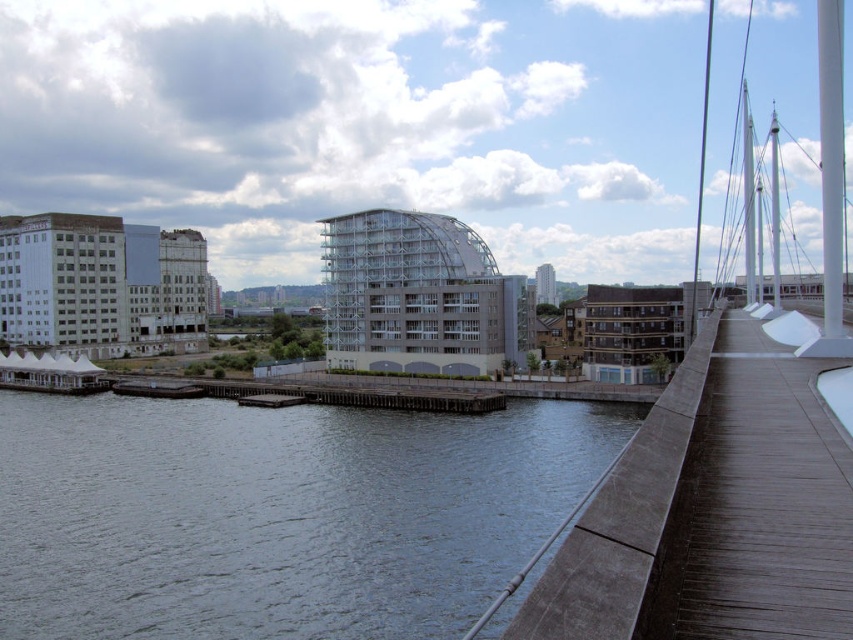
Question: Which of the following is the farthest from the observer?

Choices:
 (A) brown wooden path at right
 (B) dark gray water at lower left

Answer: (B)

Question: Which of the following is the farthest from the observer?

Choices:
 (A) dark gray water at lower left
 (B) brown wooden path at right

Answer: (A)

Question: From the image, what is the correct spatial relationship of dark gray water at lower left in relation to brown wooden path at right?

Choices:
 (A) right
 (B) left

Answer: (B)

Question: Where is dark gray water at lower left located in relation to brown wooden path at right in the image?

Choices:
 (A) right
 (B) left

Answer: (B)

Question: Does dark gray water at lower left come in front of brown wooden path at right?

Choices:
 (A) no
 (B) yes

Answer: (A)